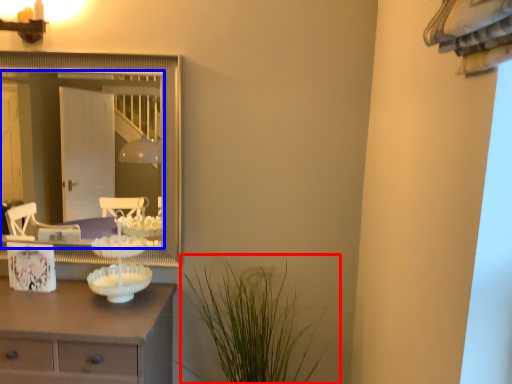
Question: Which point is further to the camera, plant (highlighted by a red box) or mirror (highlighted by a blue box)?

Choices:
 (A) plant
 (B) mirror

Answer: (B)